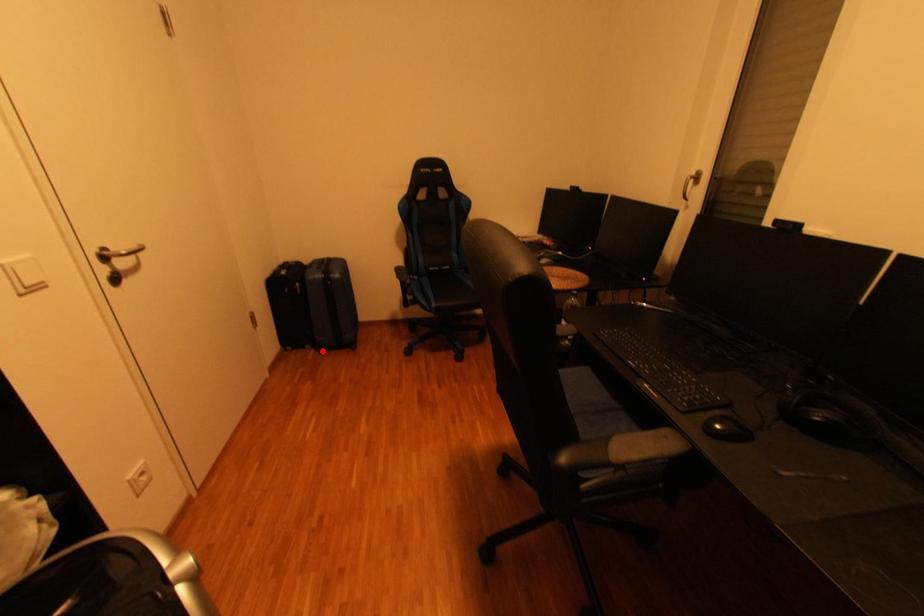
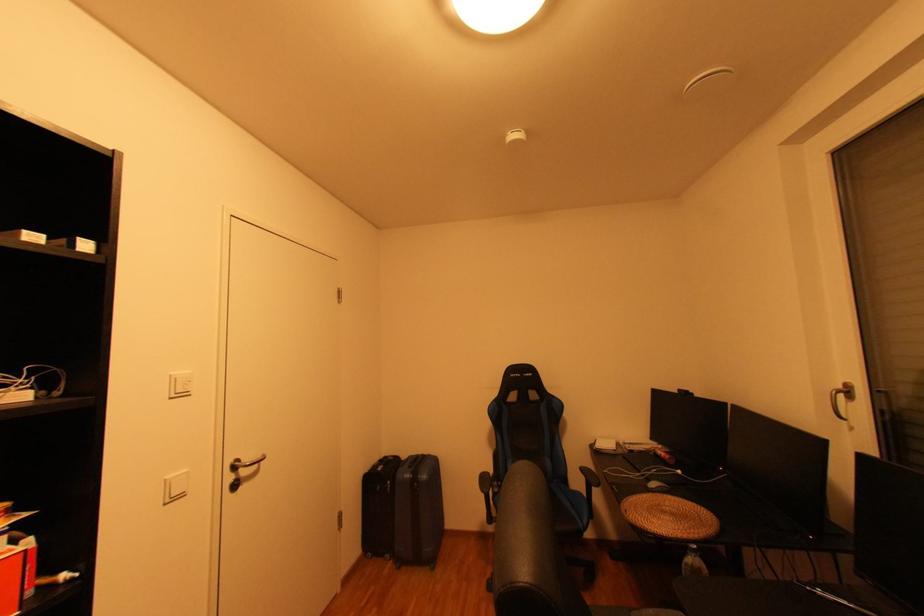
Locate, in the second image, the point that corresponds to the highlighted location in the first image.

(400, 562)